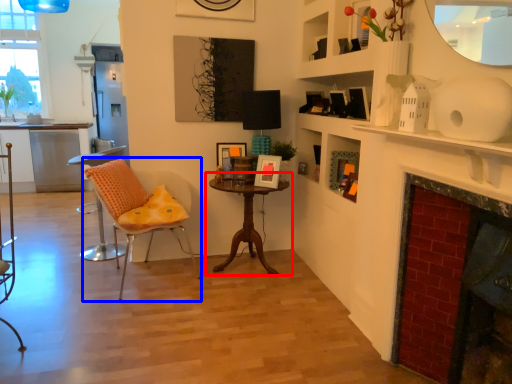
Question: Which object appears farthest to the camera in this image, table (highlighted by a red box) or chair (highlighted by a blue box)?

Choices:
 (A) table
 (B) chair

Answer: (A)